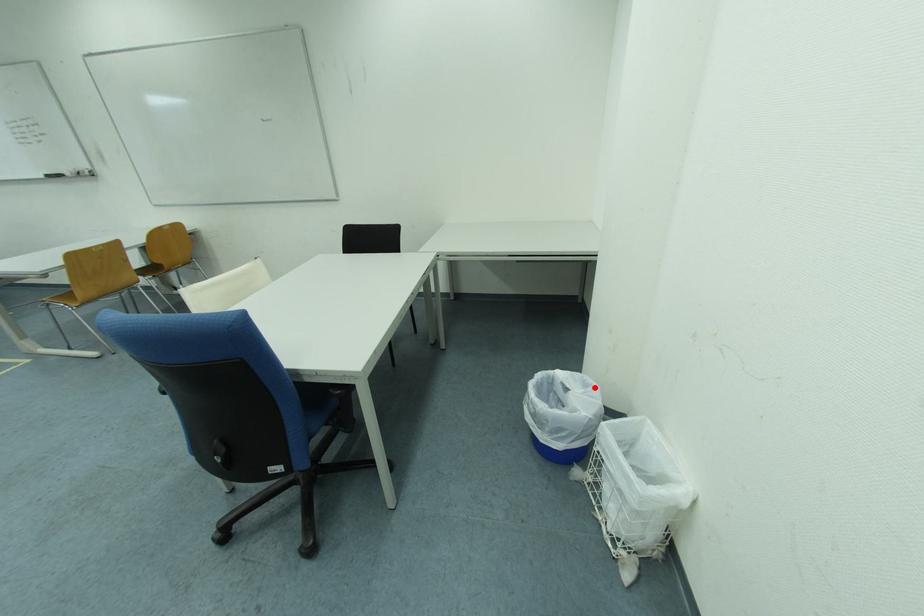
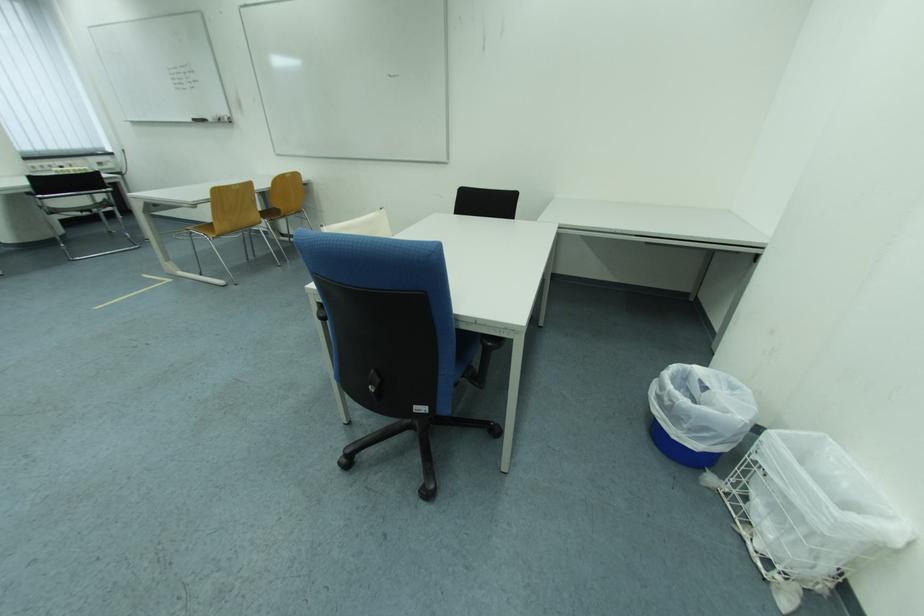
Question: I am providing you with two images of the same scene from different viewpoints. Image1 has a red point marked. In image2, the corresponding 3D location appears at what relative position? Reply with the corresponding letter.

Choices:
 (A) Closer
 (B) Farther

Answer: (B)